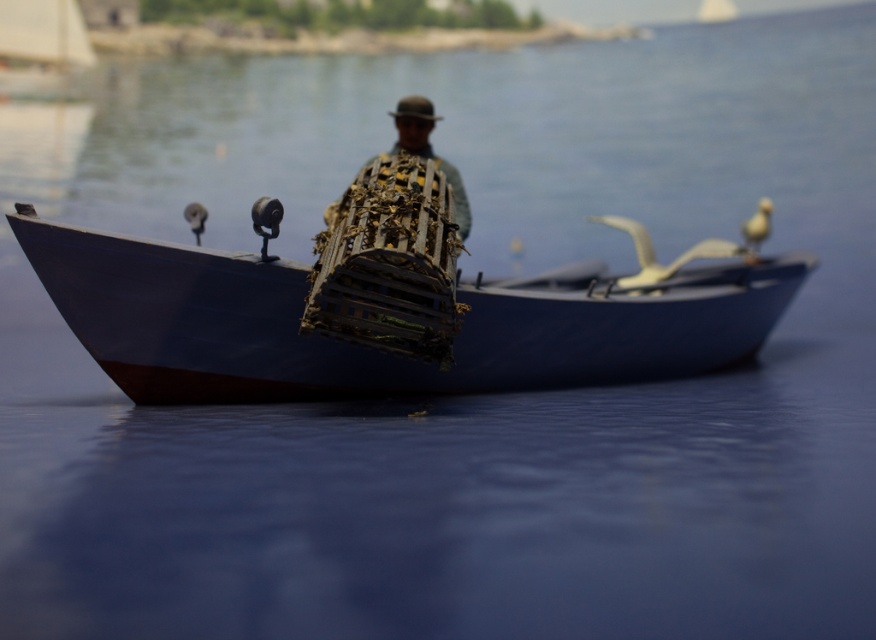
Question: Which object appears farthest from the camera in this image?

Choices:
 (A) white feathered bird at center
 (B) white feathered bird at upper right

Answer: (B)

Question: Is white feathered bird at center behind matte black bird at center?

Choices:
 (A) yes
 (B) no

Answer: (A)

Question: Is white feathered bird at upper right further to camera compared to matte black bird at center?

Choices:
 (A) yes
 (B) no

Answer: (A)

Question: Which point is closer to the camera?

Choices:
 (A) white feathered bird at upper right
 (B) metallic blue boat at center

Answer: (B)

Question: From the image, what is the correct spatial relationship of white feathered bird at center in relation to white feathered bird at upper right?

Choices:
 (A) below
 (B) above

Answer: (A)

Question: Which object is the closest to the white feathered bird at upper right?

Choices:
 (A) white feathered bird at center
 (B) matte black bird at center
 (C) metallic blue boat at center

Answer: (A)